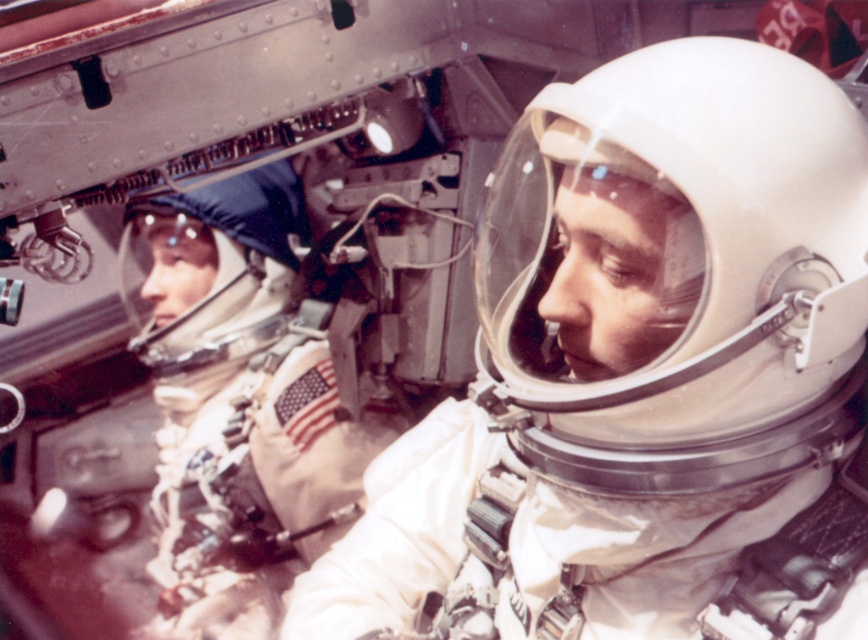
Who is more distant from viewer, (569, 129) or (239, 296)?

Point (239, 296)

Which of these two, white matte helmet at center or white matte spacesuit at center, stands shorter?

white matte helmet at center

Does point (557, 412) come closer to viewer compared to point (353, 426)?

Yes, it is in front of point (353, 426).

Find the location of a particular element. white matte helmet at center is located at coordinates (686, 269).

Who is shorter, white matte helmet at center or white matte helmet at left?

white matte helmet at center

Who is more distant from viewer, (x=557, y=436) or (x=267, y=301)?

Point (x=267, y=301)

Image resolution: width=868 pixels, height=640 pixels. What are the coordinates of `white matte helmet at center` in the screenshot? It's located at tap(686, 269).

Can you confirm if white matte spacesuit at center is smaller than white matte helmet at left?

Actually, white matte spacesuit at center might be larger than white matte helmet at left.

Does point (156, 209) come in front of point (240, 262)?

Yes, point (156, 209) is closer to viewer.

Where is `white matte spacesuit at center`? Image resolution: width=868 pixels, height=640 pixels. white matte spacesuit at center is located at coordinates (238, 396).